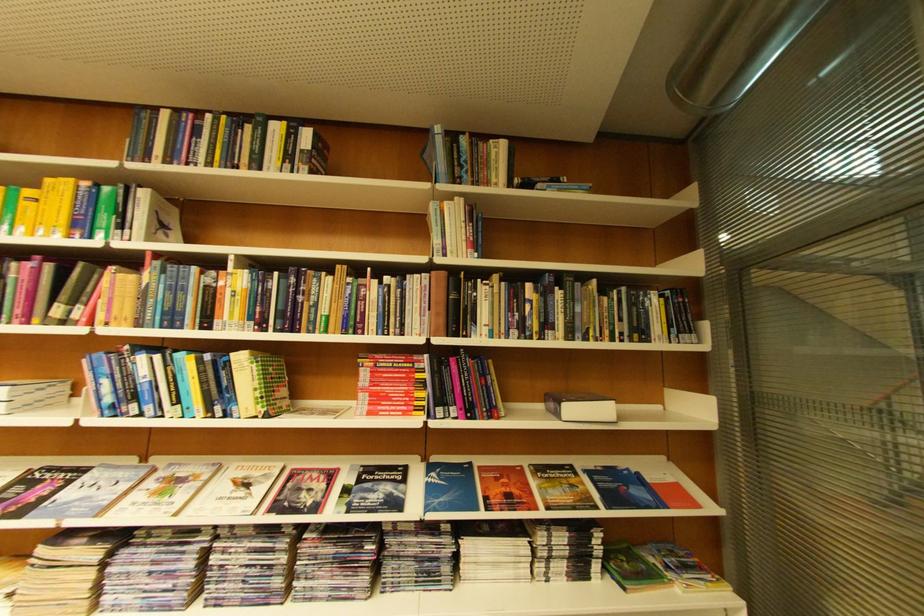
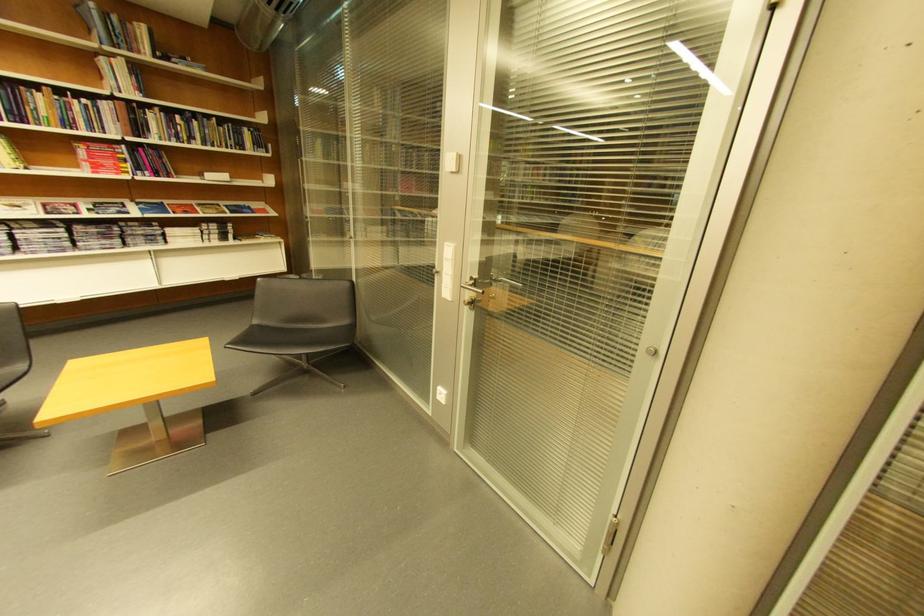
The point at [444,209] is marked in the first image. Where is the corresponding point in the second image?

(113, 62)